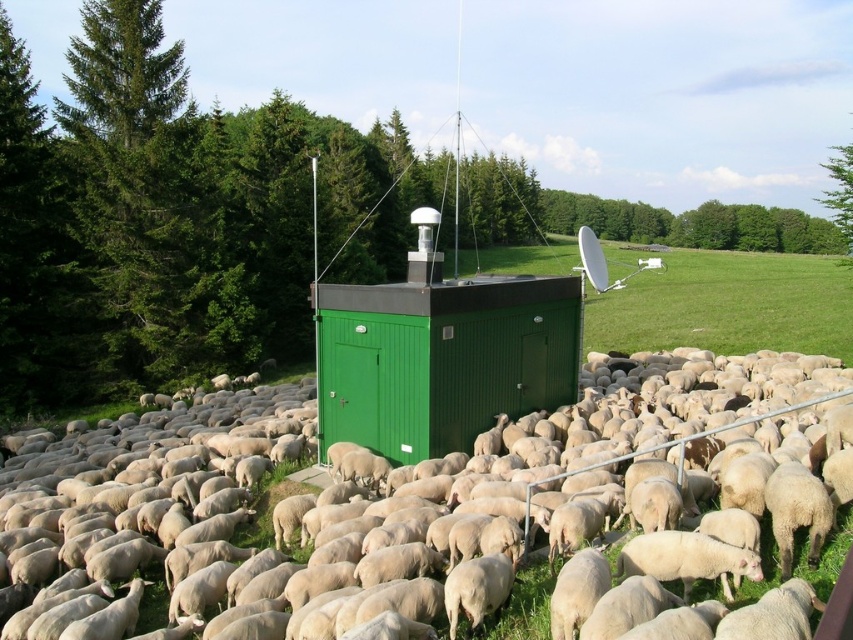
Question: Observing the image, what is the correct spatial positioning of white woolly sheep at center in reference to green corrugated metal hut at center?

Choices:
 (A) right
 (B) left

Answer: (A)

Question: Is white woolly sheep at center wider than green corrugated metal hut at center?

Choices:
 (A) yes
 (B) no

Answer: (A)

Question: Among these points, which one is farthest from the camera?

Choices:
 (A) (450, 321)
 (B) (421, 534)

Answer: (A)

Question: Considering the relative positions of white woolly sheep at center and green corrugated metal hut at center in the image provided, where is white woolly sheep at center located with respect to green corrugated metal hut at center?

Choices:
 (A) below
 (B) above

Answer: (A)

Question: Which object is closer to the camera taking this photo?

Choices:
 (A) white woolly sheep at center
 (B) green corrugated metal hut at center

Answer: (A)